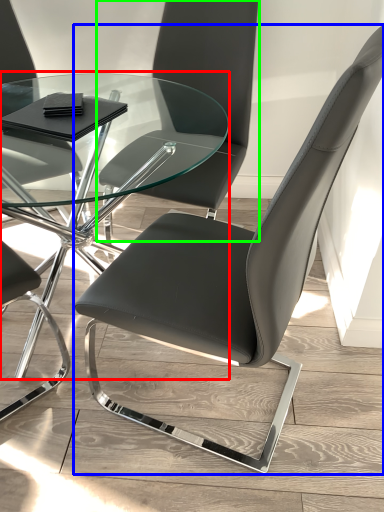
Question: Which object is positioned closest to table (highlighted by a red box)? Select from chair (highlighted by a blue box) and chair (highlighted by a green box).

Choices:
 (A) chair
 (B) chair

Answer: (B)